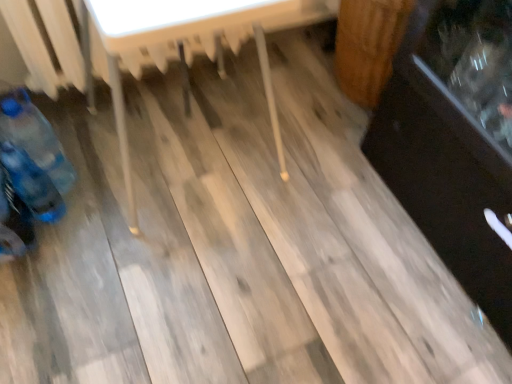
Locate an element on the screen. free space on the front side of wooden table at center is located at coordinates (166, 289).